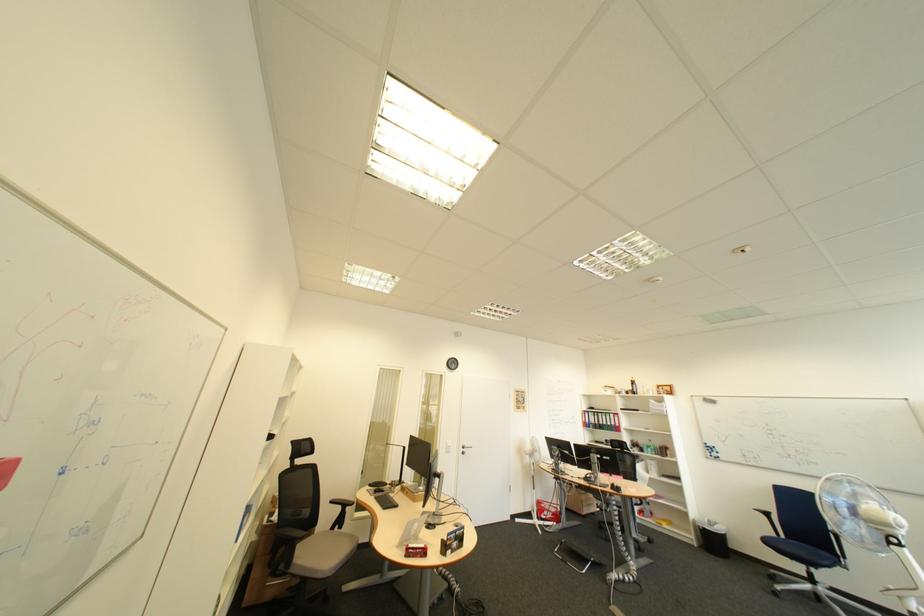
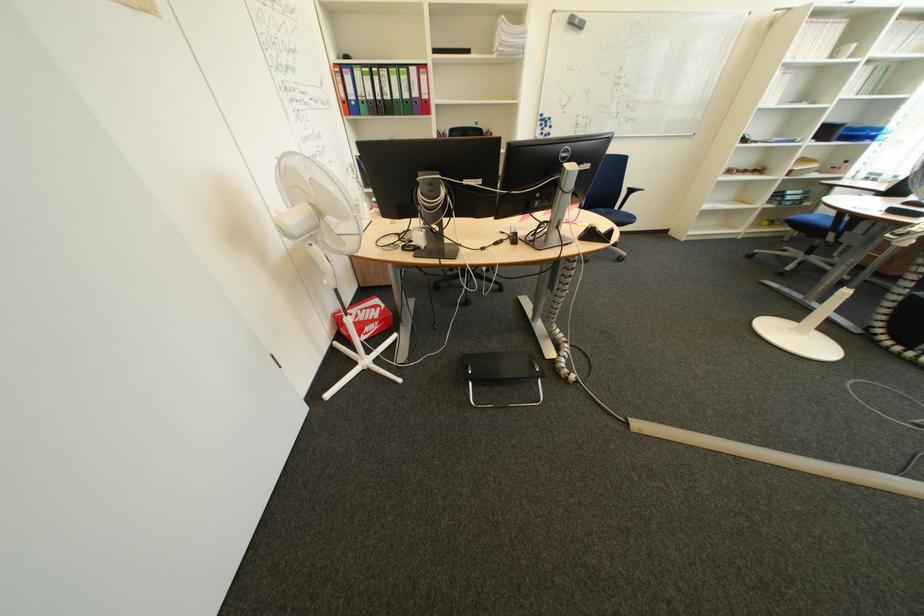
The point at (622,459) is marked in the first image. Where is the corresponding point in the second image?

(601, 168)